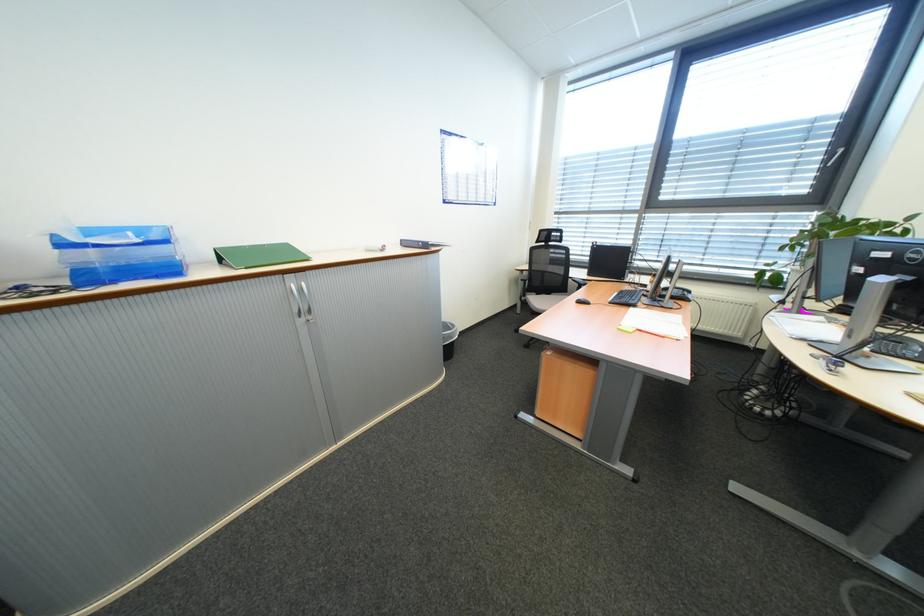
You are a GUI agent. You are given a task and a screenshot of the screen. Output one action in this format:
    pyautogui.click(x=<x>, y=<y>)
    Task: Click on the green desk file
    The image size is (924, 616).
    Given the screenshot: What is the action you would take?
    pyautogui.click(x=258, y=254)